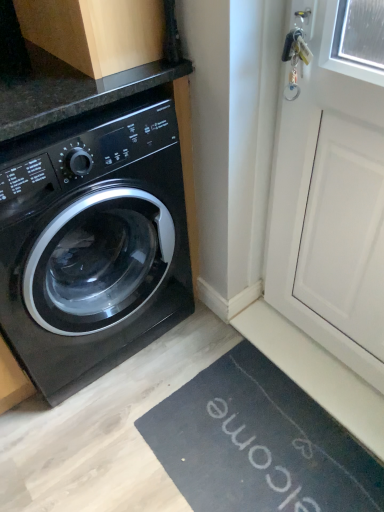
Question: Is there a large distance between wooden cabinet at upper left and black glossy washing machine at left?

Choices:
 (A) no
 (B) yes

Answer: (A)

Question: Is wooden cabinet at upper left at the left side of black glossy washing machine at left?

Choices:
 (A) yes
 (B) no

Answer: (B)

Question: Is wooden cabinet at upper left to the right of black glossy washing machine at left from the viewer's perspective?

Choices:
 (A) no
 (B) yes

Answer: (B)

Question: Is wooden cabinet at upper left outside black glossy washing machine at left?

Choices:
 (A) no
 (B) yes

Answer: (B)

Question: From the image's perspective, is wooden cabinet at upper left above black glossy washing machine at left?

Choices:
 (A) no
 (B) yes

Answer: (B)

Question: Is wooden cabinet at upper left bigger or smaller than white matte screen door at upper right?

Choices:
 (A) big
 (B) small

Answer: (B)

Question: Is point (152, 23) positioned closer to the camera than point (319, 46)?

Choices:
 (A) farther
 (B) closer

Answer: (A)

Question: Visually, is wooden cabinet at upper left positioned to the left or to the right of white matte screen door at upper right?

Choices:
 (A) right
 (B) left

Answer: (B)

Question: From a real-world perspective, is wooden cabinet at upper left positioned above or below white matte screen door at upper right?

Choices:
 (A) above
 (B) below

Answer: (A)

Question: From a real-world perspective, is wooden cabinet at upper left physically located above or below black rubber bath mat at lower right?

Choices:
 (A) below
 (B) above

Answer: (B)

Question: In terms of width, does wooden cabinet at upper left look wider or thinner when compared to black rubber bath mat at lower right?

Choices:
 (A) wide
 (B) thin

Answer: (B)

Question: Considering the positions of point (134, 12) and point (203, 428), is point (134, 12) closer or farther from the camera than point (203, 428)?

Choices:
 (A) farther
 (B) closer

Answer: (B)

Question: From the image's perspective, relative to black rubber bath mat at lower right, is wooden cabinet at upper left above or below?

Choices:
 (A) above
 (B) below

Answer: (A)

Question: In the image, is black glossy washing machine at left positioned in front of or behind white matte screen door at upper right?

Choices:
 (A) behind
 (B) front

Answer: (A)

Question: Considering the positions of black glossy washing machine at left and white matte screen door at upper right in the image, is black glossy washing machine at left taller or shorter than white matte screen door at upper right?

Choices:
 (A) short
 (B) tall

Answer: (A)